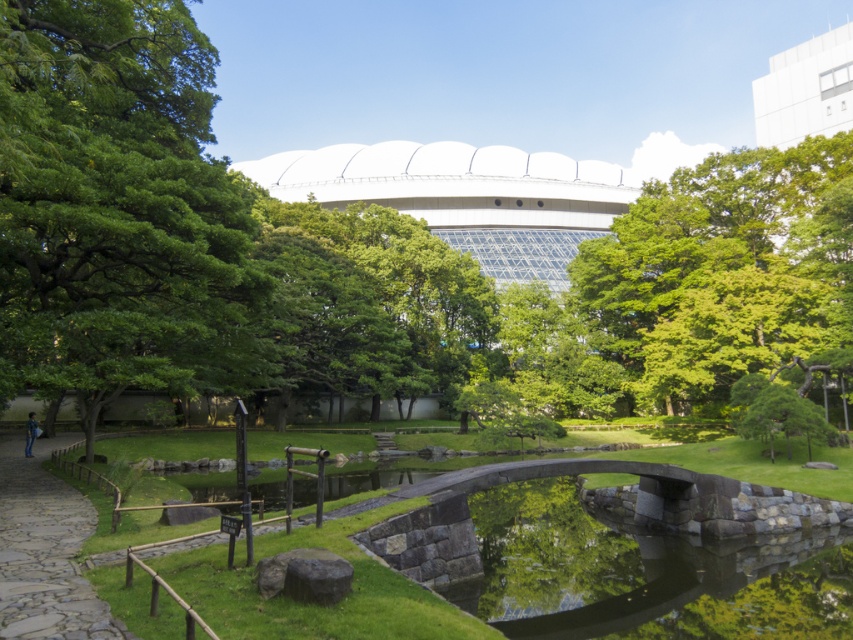
Does green leafy tree at upper center appear over pebble stone path at lower left?

Yes, green leafy tree at upper center is above pebble stone path at lower left.

Between point (601, 273) and point (61, 586), which one is positioned behind?

Positioned behind is point (601, 273).

Where is `green leafy tree at upper center`? This screenshot has height=640, width=853. green leafy tree at upper center is located at coordinates (727, 272).

Between green leafy tree at upper left and green leafy tree at upper center, which one appears on the left side from the viewer's perspective?

green leafy tree at upper left is more to the left.

Does green leafy tree at upper left have a lesser height compared to green leafy tree at upper center?

Yes, green leafy tree at upper left is shorter than green leafy tree at upper center.

Who is more distant from viewer, [144,316] or [640,353]?

The point [640,353] is more distant.

Image resolution: width=853 pixels, height=640 pixels. I want to click on green leafy tree at upper left, so click(119, 209).

How much distance is there between green leafy tree at upper left and pebble stone path at lower left?

The distance of green leafy tree at upper left from pebble stone path at lower left is 19.28 feet.

Does green leafy tree at upper left have a greater height compared to pebble stone path at lower left?

Indeed, green leafy tree at upper left has a greater height compared to pebble stone path at lower left.

Image resolution: width=853 pixels, height=640 pixels. What do you see at coordinates (119, 209) in the screenshot?
I see `green leafy tree at upper left` at bounding box center [119, 209].

In order to click on green leafy tree at upper left in this screenshot , I will do `click(119, 209)`.